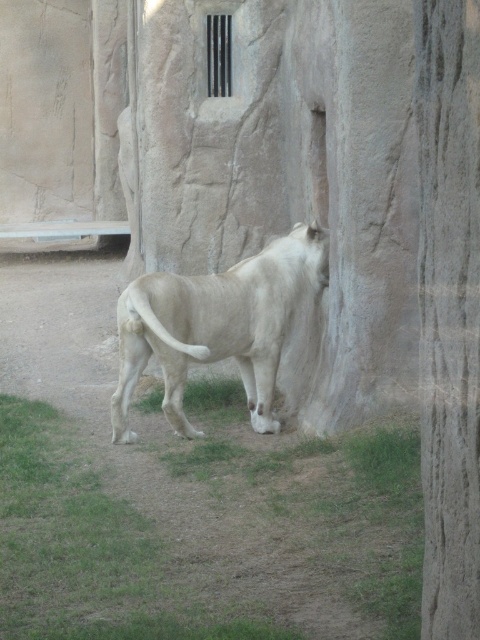
Does green grass at lower center have a greater height compared to white fur lion at center?

In fact, green grass at lower center may be shorter than white fur lion at center.

Based on the photo, does green grass at lower center have a lesser width compared to white fur lion at center?

No.

Which is behind, point (288, 465) or point (275, 276)?

The point (275, 276) is more distant.

You are a GUI agent. You are given a task and a screenshot of the screen. Output one action in this format:
    pyautogui.click(x=<x>, y=<y>)
    Task: Click on the green grass at lower center
    
    Given the screenshot: What is the action you would take?
    pyautogui.click(x=205, y=529)